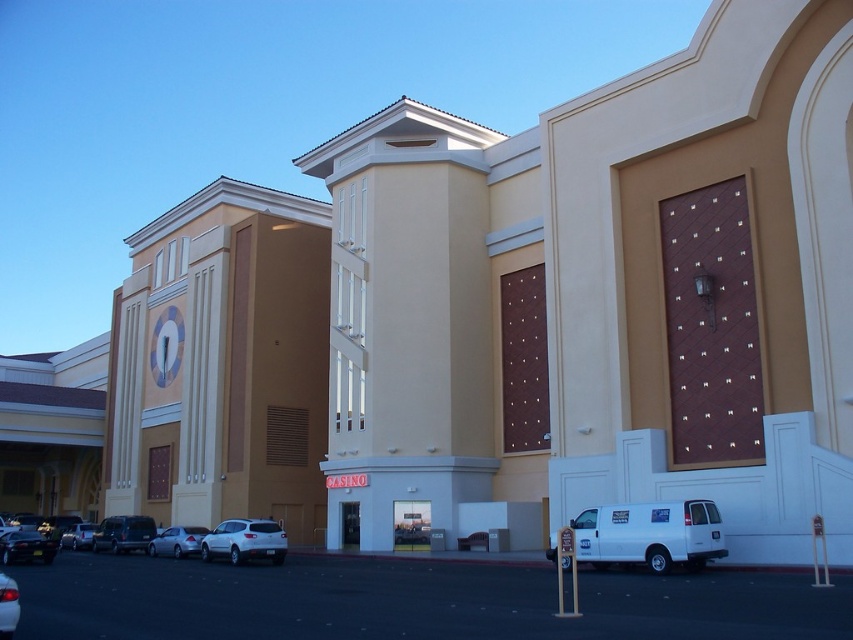
From the picture: You are a delivery person arriving at the casino. You need to park your vehicle, which is 1.8 meters tall, in a spot that can accommodate its height. Given the white matte sedan at center and the silver metallic sedan at lower left are already parked, which vehicle should you avoid parking next to to ensure there is enough space?

The white matte sedan at center is taller than the silver metallic sedan at lower left. Since your vehicle is 1.8 meters tall, you should avoid parking next to the white matte sedan at center as it is taller and may block access or require more clearance space.

You are a valet parking attendant and need to park a new car. You see the white matte car at center and the shiny silver sedan at lower left. Which car is closer to the entrance of the CASINO building?

The shiny silver sedan at lower left is closer to the entrance of the CASINO building because the white matte car at center is positioned on the right side of it, meaning the silver sedan is in front.

You are standing in front of the casino building and want to walk from point [721,538] to point [241,525]. Which direction should you move in relation to the building?

You should move downward and to the right because point [241,525] is lower and slightly to the right compared to point [721,538].